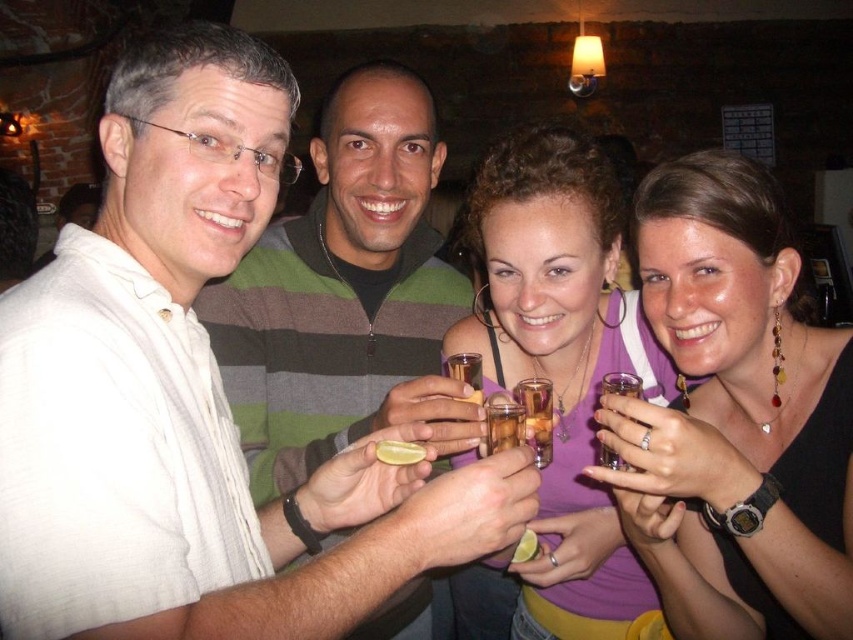
What is located at the coordinates point (735,417)?

The coordinates point (735,417) are occupied by the matte black dress at center.

You are standing at the back of the room and want to hand a drink to both the white matte shirt at left and the purple fabric tank top at center. Which person will you reach first?

You will reach the white matte shirt at left first because they are closer to you than the purple fabric tank top at center.

You are a photographer standing at the back of the room. You want to take a photo of the white matte shirt at left and the other person next to them. How far apart are they?

The white matte shirt at left and the other person next to them are 38.53 inches apart.